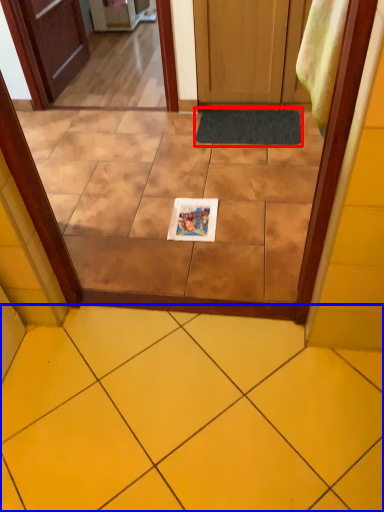
Question: Which object appears closest to the camera in this image, doormat (highlighted by a red box) or ceramic tile (highlighted by a blue box)?

Choices:
 (A) doormat
 (B) ceramic tile

Answer: (B)